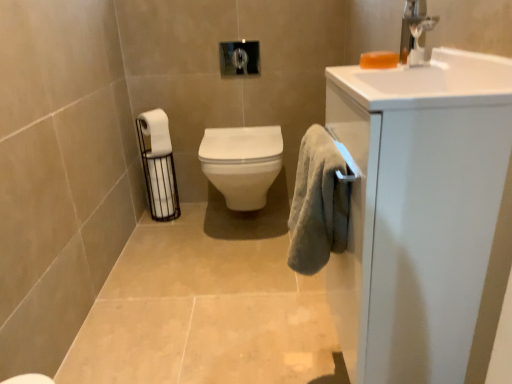
Question: Does orange translucent soap at upper right have a larger size compared to silver metallic faucet at upper right?

Choices:
 (A) yes
 (B) no

Answer: (B)

Question: Does orange translucent soap at upper right lie behind silver metallic faucet at upper right?

Choices:
 (A) no
 (B) yes

Answer: (B)

Question: Considering the relative sizes of orange translucent soap at upper right and silver metallic faucet at upper right in the image provided, is orange translucent soap at upper right shorter than silver metallic faucet at upper right?

Choices:
 (A) no
 (B) yes

Answer: (B)

Question: Is orange translucent soap at upper right far from silver metallic faucet at upper right?

Choices:
 (A) no
 (B) yes

Answer: (A)

Question: Does orange translucent soap at upper right have a greater height compared to silver metallic faucet at upper right?

Choices:
 (A) no
 (B) yes

Answer: (A)

Question: Looking at their shapes, would you say white matte toilet paper at left, acting as the second toilet paper starting from the bottom, is wider or thinner than silver metallic faucet at upper right?

Choices:
 (A) wide
 (B) thin

Answer: (A)

Question: In terms of height, does white matte toilet paper at left, which is the 1th toilet paper in top-to-bottom order, look taller or shorter compared to silver metallic faucet at upper right?

Choices:
 (A) tall
 (B) short

Answer: (A)

Question: Considering the relative positions of white matte toilet paper at left, acting as the second toilet paper starting from the bottom, and silver metallic faucet at upper right in the image provided, is white matte toilet paper at left, acting as the second toilet paper starting from the bottom, to the left or to the right of silver metallic faucet at upper right?

Choices:
 (A) right
 (B) left

Answer: (B)

Question: From the image's perspective, is white matte toilet paper at left, which is the 1th toilet paper in top-to-bottom order, positioned above or below silver metallic faucet at upper right?

Choices:
 (A) below
 (B) above

Answer: (A)

Question: Considering the positions of point [x=315, y=162] and point [x=404, y=34], is point [x=315, y=162] closer or farther from the camera than point [x=404, y=34]?

Choices:
 (A) farther
 (B) closer

Answer: (B)

Question: In terms of width, does soft gray towel at right look wider or thinner when compared to silver metallic faucet at upper right?

Choices:
 (A) wide
 (B) thin

Answer: (A)

Question: From the image's perspective, is soft gray towel at right located above or below silver metallic faucet at upper right?

Choices:
 (A) below
 (B) above

Answer: (A)

Question: Would you say soft gray towel at right is inside or outside silver metallic faucet at upper right?

Choices:
 (A) outside
 (B) inside

Answer: (A)

Question: From the image's perspective, relative to white glossy toilet at center, is orange translucent soap at upper right above or below?

Choices:
 (A) above
 (B) below

Answer: (A)

Question: Based on their positions, is orange translucent soap at upper right located to the left or right of white glossy toilet at center?

Choices:
 (A) left
 (B) right

Answer: (B)